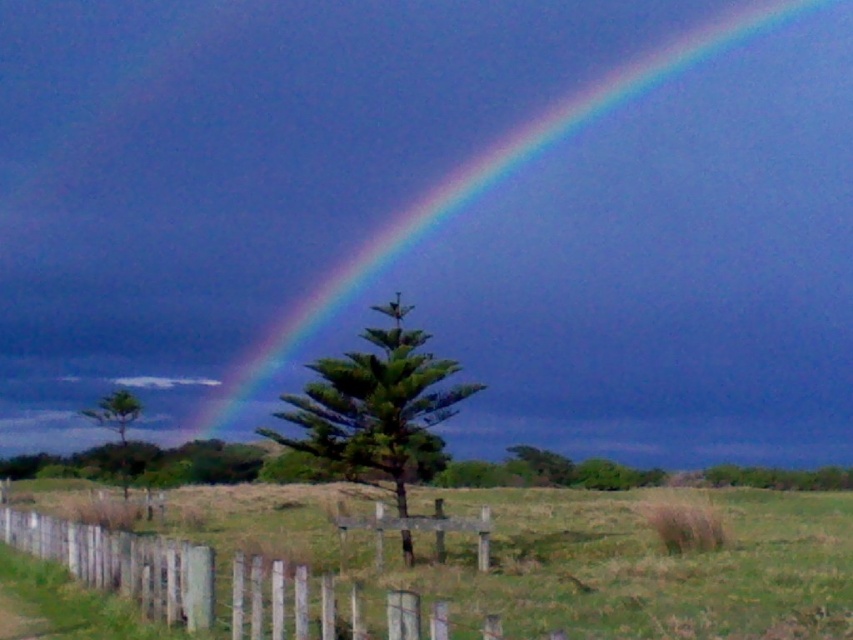
Can you confirm if rainbow at upper center is positioned above wooden picket fence at center?

Yes.

Who is shorter, rainbow at upper center or wooden picket fence at center?

With less height is wooden picket fence at center.

Does point (805, 330) lie behind point (76, 557)?

Yes, it is.

At what (x,y) coordinates should I click in order to perform the action: click on rainbow at upper center. Please return your answer as a coordinate pair (x, y). The height and width of the screenshot is (640, 853). Looking at the image, I should click on (625, 237).